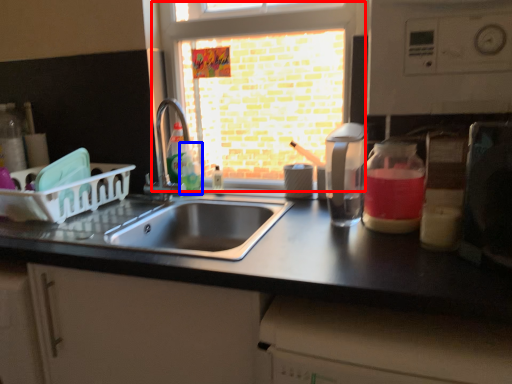
Question: Among these objects, which one is nearest to the camera, window (highlighted by a red box) or bottle (highlighted by a blue box)?

Choices:
 (A) window
 (B) bottle

Answer: (A)